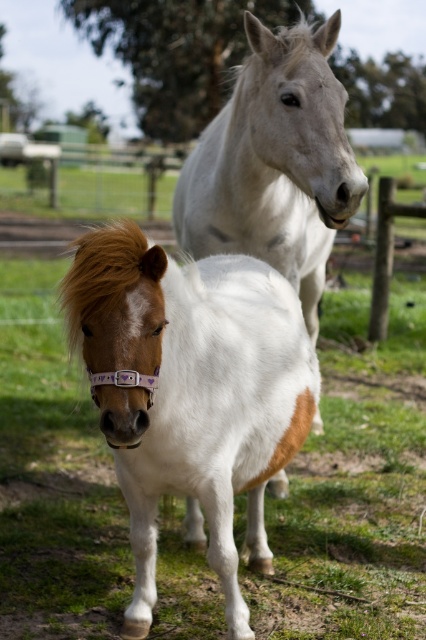
Question: Which point is closer to the camera?

Choices:
 (A) white glossy horse at upper center
 (B) white glossy pony at center

Answer: (B)

Question: Can you confirm if white glossy pony at center is positioned above white glossy horse at upper center?

Choices:
 (A) yes
 (B) no

Answer: (B)

Question: Does white glossy pony at center come behind white glossy horse at upper center?

Choices:
 (A) no
 (B) yes

Answer: (A)

Question: Which point is farther to the camera?

Choices:
 (A) (216, 164)
 (B) (138, 406)

Answer: (A)

Question: Among these objects, which one is nearest to the camera?

Choices:
 (A) white glossy pony at center
 (B) white glossy horse at upper center

Answer: (A)

Question: Does white glossy pony at center appear on the right side of white glossy horse at upper center?

Choices:
 (A) yes
 (B) no

Answer: (B)